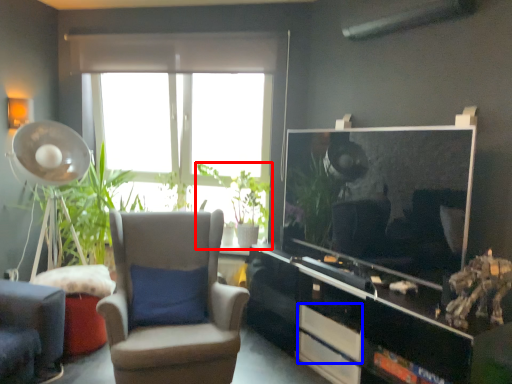
Question: Which point is further to the camera, houseplant (highlighted by a red box) or drawer (highlighted by a blue box)?

Choices:
 (A) houseplant
 (B) drawer

Answer: (A)